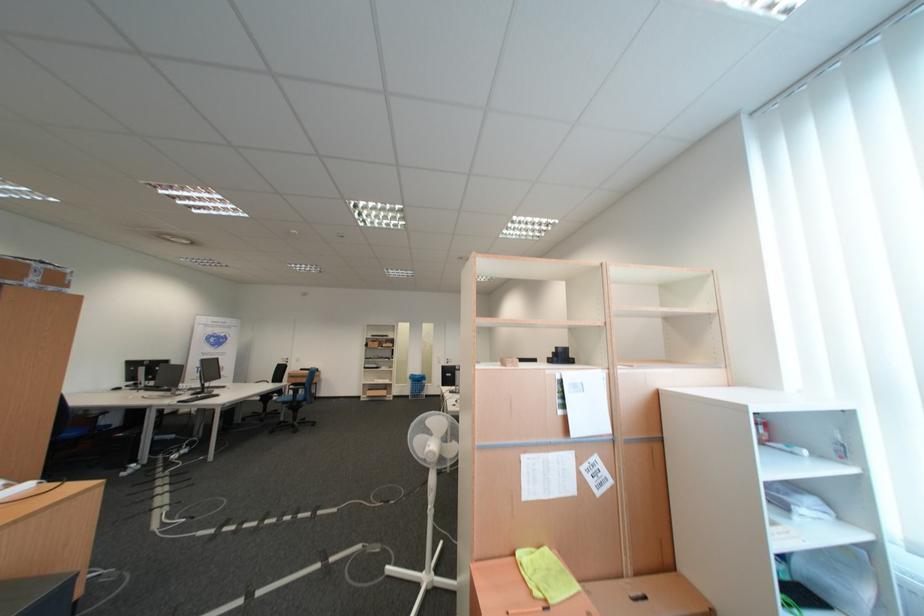
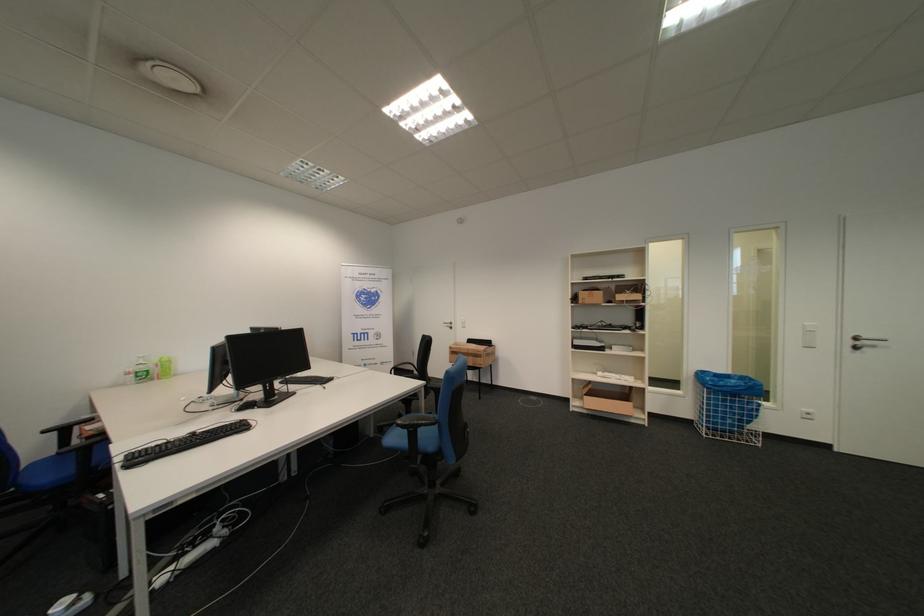
In the second image, find the point that corresponds to (428,385) in the first image.

(736, 402)